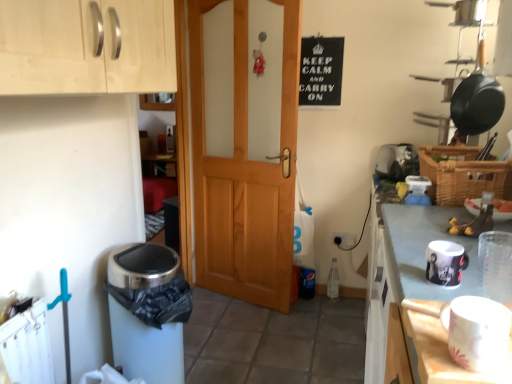
You are a GUI agent. You are given a task and a screenshot of the screen. Output one action in this format:
    pyautogui.click(x=<x>, y=<y>)
    Task: Click on the vacant area to the right of matte black mug at right, acting as the first appliance starting from the front
    
    Given the screenshot: What is the action you would take?
    pyautogui.click(x=485, y=270)